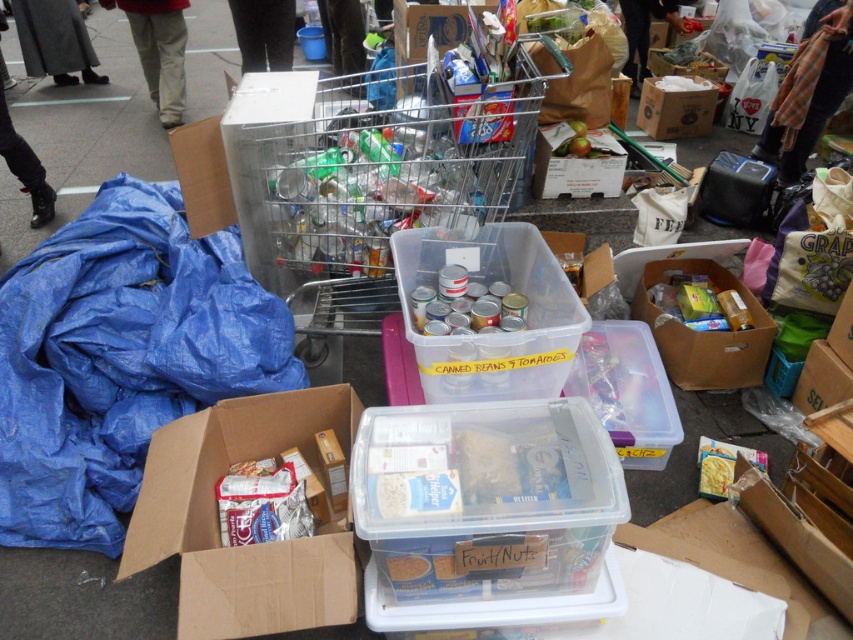
You are organizing a food drive and need to determine which container can hold more items. Based on the scene, which one is taller between the blue plastic bag at left and the clear wire shopping cart at center?

The clear wire shopping cart at center is taller than the blue plastic bag at left according to the description.

You are a volunteer at a food distribution event and need to pick up the blue plastic bag at left. Your camera is mounted on a tripod 1.80 meters away from the bag. Can you safely reach the bag without moving the camera?

The blue plastic bag at left and the camera are 1.80 meters apart. Since the camera is mounted on a tripod at that distance, you can safely reach the bag without disturbing the camera setup as the distance allows enough space for movement.